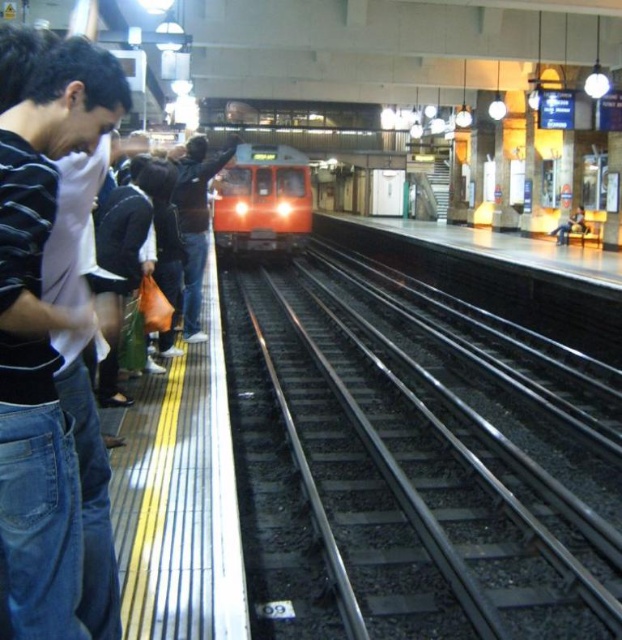
Which is above, black metal train track at center or striped cotton shirt at left?

striped cotton shirt at left

Looking at this image, who is more distant from viewer, (412, 468) or (9, 509)?

The point (412, 468) is behind.

The width and height of the screenshot is (622, 640). Find the location of `black metal train track at center`. black metal train track at center is located at coordinates (440, 456).

This screenshot has height=640, width=622. Find the location of `black metal train track at center`. black metal train track at center is located at coordinates (440, 456).

Which is above, black metal train track at center or orange glossy train at center?

orange glossy train at center

Can you confirm if black metal train track at center is wider than orange glossy train at center?

Correct, the width of black metal train track at center exceeds that of orange glossy train at center.

Describe the element at coordinates (440, 456) in the screenshot. I see `black metal train track at center` at that location.

The width and height of the screenshot is (622, 640). I want to click on black metal train track at center, so click(x=440, y=456).

This screenshot has height=640, width=622. What do you see at coordinates (44, 337) in the screenshot? I see `striped cotton shirt at left` at bounding box center [44, 337].

The image size is (622, 640). I want to click on striped cotton shirt at left, so click(x=44, y=337).